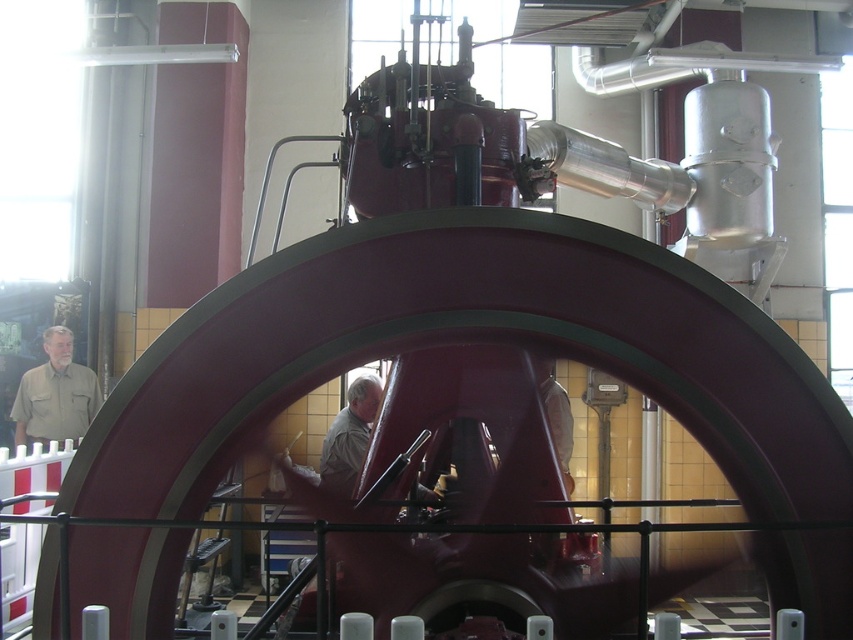
You are an engineer inspecting the machinery in this industrial setting. You notice two workers wearing shirts of different colors and sizes. The khaki shirt at left and the light beige shirt at center. Which worker is closer to the massive red cylindrical machine?

The khaki shirt at left is smaller than the light beige shirt at center. Since smaller objects in such settings are often closer, the worker in the khaki shirt at left is likely closer to the massive red cylindrical machine.

You are an engineer inspecting the machinery in this industrial setting. You notice two workers wearing shirts of different colors. The khaki shirt at left and the light beige shirt at center. Which worker is positioned higher in the image?

The khaki shirt at left is above the light beige shirt at center, so the worker wearing the khaki shirt at left is positioned higher in the image.